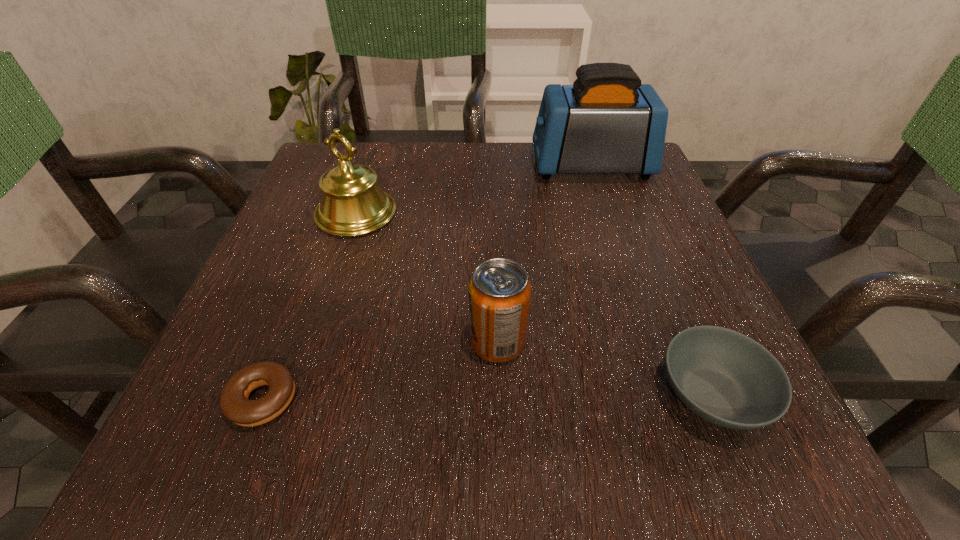
At what (x,y) coordinates should I click in order to perform the action: click on doughnut present at the left edge. Please return your answer as a coordinate pair (x, y). This screenshot has width=960, height=540. Looking at the image, I should click on (234, 403).

Find the location of a particular element. This screenshot has width=960, height=540. toaster at the right edge is located at coordinates (607, 122).

Locate an element on the screen. soup bowl located at the right edge is located at coordinates (725, 377).

Where is `object that is positioned at the far left corner`? Image resolution: width=960 pixels, height=540 pixels. object that is positioned at the far left corner is located at coordinates (352, 204).

Where is `object at the near left corner`? This screenshot has height=540, width=960. object at the near left corner is located at coordinates (234, 403).

Image resolution: width=960 pixels, height=540 pixels. In order to click on object at the far right corner in this screenshot , I will do `click(607, 122)`.

This screenshot has height=540, width=960. In order to click on object at the near right corner in this screenshot , I will do `click(725, 377)`.

In the image, there is a desktop. Where is `vacant area at the far edge`? This screenshot has height=540, width=960. vacant area at the far edge is located at coordinates (551, 181).

You are a GUI agent. You are given a task and a screenshot of the screen. Output one action in this format:
    pyautogui.click(x=<x>, y=<y>)
    Task: Click on the free location at the near edge of the desktop
    The width and height of the screenshot is (960, 540).
    Given the screenshot: What is the action you would take?
    pyautogui.click(x=535, y=442)

What are the coordinates of `vacant space at the left edge of the desktop` in the screenshot? It's located at (310, 363).